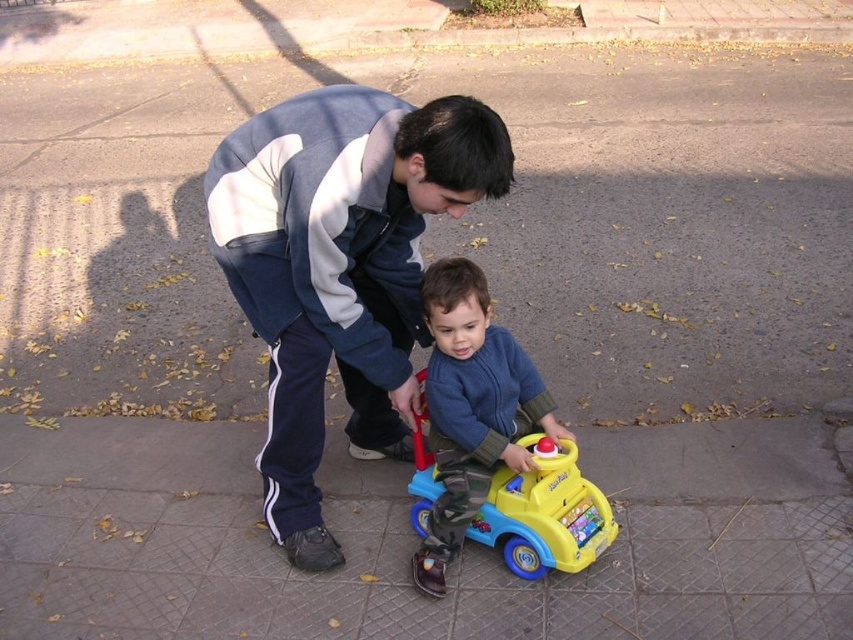
You are a delivery drone flying overhead. You need to land on the ground near the dark blue tracksuit at center and the blue soft toy car at center. Which object should you avoid landing on?

You should avoid landing on the blue soft toy car at center because the dark blue tracksuit at center is located above it, meaning the toy car is lower and might be obstructed.

You are a delivery robot with a width of 0.8 meters. You need to navigate through the space between the dark blue tracksuit at center and the blue soft toy car at center. Can you fit through the narrowest point between them?

The dark blue tracksuit at center might be wider than the blue soft toy car at center, so the narrowest point between them could be narrower than 0.8 meters. It is uncertain if the delivery robot can fit through without knowing the exact width difference.

You are a photographer trying to capture a photo of the dark blue tracksuit at center and the blue soft toy car at center. Which object should you focus on first if you want to ensure both are in the frame without moving the camera?

You should focus on the dark blue tracksuit at center first since it is taller than the blue soft toy car at center, ensuring it fits within the frame while the smaller toy car remains in view.